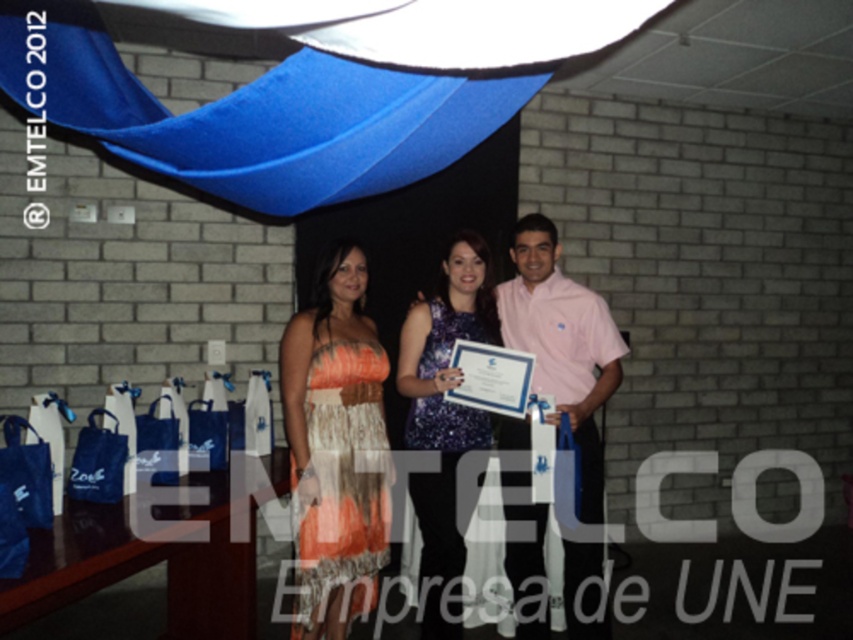
Question: Does shiny blue dress at center appear over sparkly purple dress at center?

Choices:
 (A) no
 (B) yes

Answer: (A)

Question: Does orange lace dress at center appear on the left side of pink cotton shirt at center?

Choices:
 (A) yes
 (B) no

Answer: (A)

Question: Which point is closer to the camera taking this photo?

Choices:
 (A) (451, 436)
 (B) (450, 385)

Answer: (B)

Question: Where is pink cotton shirt at center located in relation to sparkly purple dress at center in the image?

Choices:
 (A) right
 (B) left

Answer: (A)

Question: Which point is farther to the camera?

Choices:
 (A) (413, 374)
 (B) (338, 570)

Answer: (A)

Question: Among these points, which one is nearest to the camera?

Choices:
 (A) (315, 529)
 (B) (558, 336)
 (C) (466, 305)

Answer: (A)